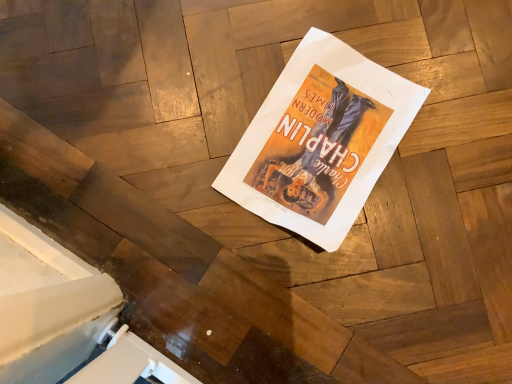
Find the location of a particular element. This screenshot has height=384, width=512. empty space that is ontop of matte paper poster at center (from a real-world perspective) is located at coordinates (370, 153).